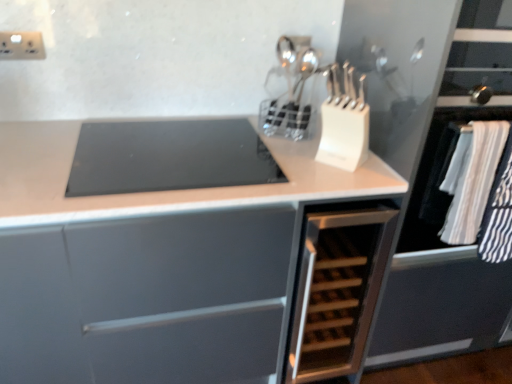
What do you see at coordinates (169, 157) in the screenshot? I see `black glass cooktop at center` at bounding box center [169, 157].

This screenshot has height=384, width=512. Describe the element at coordinates (338, 291) in the screenshot. I see `wooden rack at center, the second cabinetry viewed from the left` at that location.

Locate an element on the screen. The height and width of the screenshot is (384, 512). wooden rack at center, which appears as the first cabinetry when viewed from the right is located at coordinates (338, 291).

What do you see at coordinates (430, 169) in the screenshot?
I see `wooden at right` at bounding box center [430, 169].

In order to face matte white cabinet at center, acting as the second cabinetry starting from the right, should I rotate leftwards or rightwards?

You should rotate left by 11.693 degrees.

The height and width of the screenshot is (384, 512). Find the location of `black glass cooktop at center`. black glass cooktop at center is located at coordinates (169, 157).

Is white plastic knife block at upper center directly adjacent to white striped fabric at right?

No, white plastic knife block at upper center is not in contact with white striped fabric at right.

Who is shorter, white plastic knife block at upper center or white striped fabric at right?

white plastic knife block at upper center.

Find the location of `kitchen appliance that is above the white striped fabric at right (from a real-world perspective)`. kitchen appliance that is above the white striped fabric at right (from a real-world perspective) is located at coordinates (344, 121).

Which is nearer, [343,140] or [500,147]?

Clearly, point [343,140] is more distant from the camera than point [500,147].

Based on the photo, considering the relative sizes of white plastic knife block at upper center and wooden at right in the image provided, is white plastic knife block at upper center thinner than wooden at right?

Yes, white plastic knife block at upper center is thinner than wooden at right.

From their relative heights in the image, would you say white plastic knife block at upper center is taller or shorter than wooden at right?

In the image, white plastic knife block at upper center appears to be shorter than wooden at right.

Which is closer to the camera, (367,120) or (413,339)?

The point (367,120) is more forward.

Is point (323, 159) less distant than point (327, 222)?

No, it is not.

Considering the sizes of objects white plastic knife block at upper center and wooden rack at center, the second cabinetry viewed from the left, in the image provided, who is bigger, white plastic knife block at upper center or wooden rack at center, the second cabinetry viewed from the left,?

With larger size is wooden rack at center, the second cabinetry viewed from the left.

Between white plastic knife block at upper center and wooden rack at center, the second cabinetry viewed from the left, which one appears on the left side from the viewer's perspective?

wooden rack at center, the second cabinetry viewed from the left.

How distant is white plastic knife block at upper center from wooden rack at center, which appears as the first cabinetry when viewed from the right?

The distance of white plastic knife block at upper center from wooden rack at center, which appears as the first cabinetry when viewed from the right, is 15.58 inches.

Identify the location of cabinetry that is the 2nd object to the left of the white plastic knife block at upper center, starting at the anchor. This screenshot has height=384, width=512. (151, 267).

Can we say white plastic knife block at upper center lies outside matte white cabinet at center, acting as the second cabinetry starting from the right?

white plastic knife block at upper center lies outside matte white cabinet at center, acting as the second cabinetry starting from the right,'s area.

Which is closer, (336, 66) or (42, 278)?

Point (336, 66) appears to be farther away from the viewer than point (42, 278).

Is matte white cabinet at center, the first cabinetry positioned from the left, at the back of white plastic knife block at upper center?

white plastic knife block at upper center does not have its back to matte white cabinet at center, the first cabinetry positioned from the left.

From the image's perspective, would you say white plastic electric outlet at upper left is positioned over black glass cooktop at center?

Yes, from the image's perspective, white plastic electric outlet at upper left is on top of black glass cooktop at center.

Which object is closer to the camera, white plastic electric outlet at upper left or black glass cooktop at center?

black glass cooktop at center is more forward.

Is white plastic electric outlet at upper left next to black glass cooktop at center and touching it?

white plastic electric outlet at upper left and black glass cooktop at center are not in contact.

Considering the points (39, 42) and (168, 159), which point is in front, point (39, 42) or point (168, 159)?

The point (168, 159) is closer to the camera.

From a real-world perspective, is white plastic electric outlet at upper left located beneath wooden at right?

No, from a real-world perspective, white plastic electric outlet at upper left is not below wooden at right.

In order to click on electric outlet that is on the left side of wooden at right in this screenshot , I will do `click(21, 46)`.

Could you tell me if white plastic electric outlet at upper left is facing wooden at right?

No, white plastic electric outlet at upper left is not oriented towards wooden at right.

In terms of width, does white plastic electric outlet at upper left look wider or thinner when compared to wooden at right?

Considering their sizes, white plastic electric outlet at upper left looks slimmer than wooden at right.

Considering the relative sizes of wooden rack at center, which appears as the first cabinetry when viewed from the right, and white plastic knife block at upper center in the image provided, is wooden rack at center, which appears as the first cabinetry when viewed from the right, shorter than white plastic knife block at upper center?

No.

In the scene shown: From the image's perspective, which is above, wooden rack at center, which appears as the first cabinetry when viewed from the right, or white plastic knife block at upper center?

From the image's view, white plastic knife block at upper center is above.

Would you say wooden rack at center, the second cabinetry viewed from the left, is outside white plastic knife block at upper center?

Yes, wooden rack at center, the second cabinetry viewed from the left, is not within white plastic knife block at upper center.

From a real-world perspective, which object rests below the other?

wooden rack at center, which appears as the first cabinetry when viewed from the right, from a real-world perspective.

Locate an element on the screen. laundry that appears on the right of white plastic knife block at upper center is located at coordinates [x=472, y=179].

I want to click on kitchen appliance lying above the wooden at right (from the image's perspective), so click(x=344, y=121).

From the image, which object appears to be farther from wooden rack at center, which appears as the first cabinetry when viewed from the right, white striped fabric at right or white plastic electric outlet at upper left?

white plastic electric outlet at upper left is positioned further to the anchor wooden rack at center, which appears as the first cabinetry when viewed from the right.

When comparing their distances from wooden at right, does black glass cooktop at center or white striped fabric at right seem closer?

white striped fabric at right lies closer to wooden at right than the other object.

In the scene shown: Estimate the real-world distances between objects in this image. Which object is further from matte white cabinet at center, the first cabinetry positioned from the left, white striped fabric at right or white plastic knife block at upper center?

Among the two, white striped fabric at right is located further to matte white cabinet at center, the first cabinetry positioned from the left.

Looking at this image, which object lies nearer to the anchor point white plastic knife block at upper center, black glass cooktop at center or wooden rack at center, which appears as the first cabinetry when viewed from the right?

Among the two, black glass cooktop at center is located nearer to white plastic knife block at upper center.

Considering their positions, is white plastic knife block at upper center positioned further to white striped fabric at right than white plastic electric outlet at upper left?

white plastic electric outlet at upper left lies further to white striped fabric at right than the other object.

Based on their spatial positions, is wooden rack at center, which appears as the first cabinetry when viewed from the right, or white plastic electric outlet at upper left further from white plastic knife block at upper center?

The object further to white plastic knife block at upper center is white plastic electric outlet at upper left.

Considering their positions, is white plastic knife block at upper center positioned further to wooden rack at center, which appears as the first cabinetry when viewed from the right, than matte white cabinet at center, acting as the second cabinetry starting from the right?

The object further to wooden rack at center, which appears as the first cabinetry when viewed from the right, is white plastic knife block at upper center.

When comparing their distances from matte white cabinet at center, the first cabinetry positioned from the left, does white plastic knife block at upper center or white striped fabric at right seem closer?

white plastic knife block at upper center.

You are a GUI agent. You are given a task and a screenshot of the screen. Output one action in this format:
    pyautogui.click(x=<x>, y=<y>)
    Task: Click on the kitchen appliance between white plastic electric outlet at upper left and wooden at right in the horizontal direction
    The height and width of the screenshot is (384, 512).
    Given the screenshot: What is the action you would take?
    pyautogui.click(x=344, y=121)

I want to click on laundry located between wooden rack at center, the second cabinetry viewed from the left, and wooden at right in the left-right direction, so click(x=472, y=179).

This screenshot has height=384, width=512. What are the coordinates of `cabinetry between black glass cooktop at center and white striped fabric at right` in the screenshot? It's located at (338, 291).

Locate an element on the screen. Image resolution: width=512 pixels, height=384 pixels. cabinetry between matte white cabinet at center, the first cabinetry positioned from the left, and white striped fabric at right is located at coordinates (338, 291).